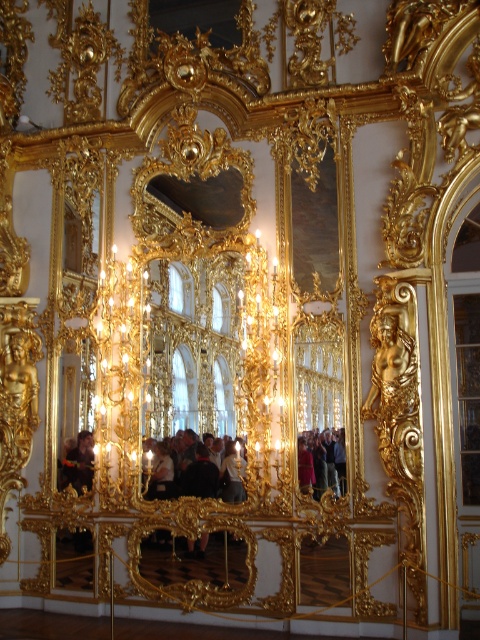
Question: Which of the following is the farthest from the observer?

Choices:
 (A) tap(103, 301)
 (B) tap(300, 460)
 (C) tap(85, 474)

Answer: (A)

Question: Where is dark brown leather jacket at center located in relation to matte black jacket at center in the image?

Choices:
 (A) above
 (B) below

Answer: (B)

Question: Which point is closer to the camera taking this photo?

Choices:
 (A) (74, 445)
 (B) (229, 440)

Answer: (B)

Question: Which of these objects is positioned closest to the dark brown leather jacket at lower left?

Choices:
 (A) dark brown leather jacket at center
 (B) matte black jacket at center
 (C) shiny gold chandelier at center

Answer: (C)

Question: Is dark brown leather jacket at center thinner than matte black jacket at center?

Choices:
 (A) yes
 (B) no

Answer: (B)

Question: Does dark brown leather jacket at center have a greater width compared to dark brown leather jacket at lower left?

Choices:
 (A) yes
 (B) no

Answer: (A)